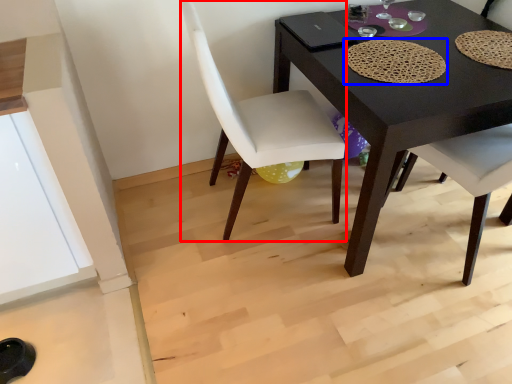
Question: Among these objects, which one is nearest to the camera, chair (highlighted by a red box) or mat (highlighted by a blue box)?

Choices:
 (A) chair
 (B) mat

Answer: (A)